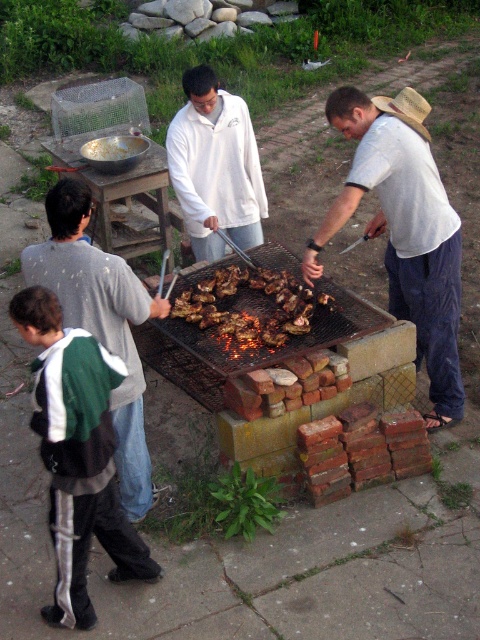
Does white matte shirt at center appear on the right side of green and white fleece jacket at lower left?

Indeed, white matte shirt at center is positioned on the right side of green and white fleece jacket at lower left.

What are the coordinates of `white matte shirt at center` in the screenshot? It's located at (404, 228).

In the scene shown: Who is lower down, white matte shirt at center or grilled meat at center?

Positioned lower is grilled meat at center.

Which is more to the right, white matte shirt at center or grilled meat at center?

white matte shirt at center is more to the right.

Which is in front, point (416, 152) or point (229, 291)?

Point (416, 152) is more forward.

Locate an element on the screen. The image size is (480, 640). white matte shirt at center is located at coordinates (404, 228).

Which is in front, point (97, 360) or point (402, 100)?

Positioned in front is point (97, 360).

Is green and white fleece jacket at lower left wider than strawmaterial/texturehat at upper right?

Yes.

Image resolution: width=480 pixels, height=640 pixels. What do you see at coordinates (78, 454) in the screenshot?
I see `green and white fleece jacket at lower left` at bounding box center [78, 454].

What are the coordinates of `green and white fleece jacket at lower left` in the screenshot? It's located at (78, 454).